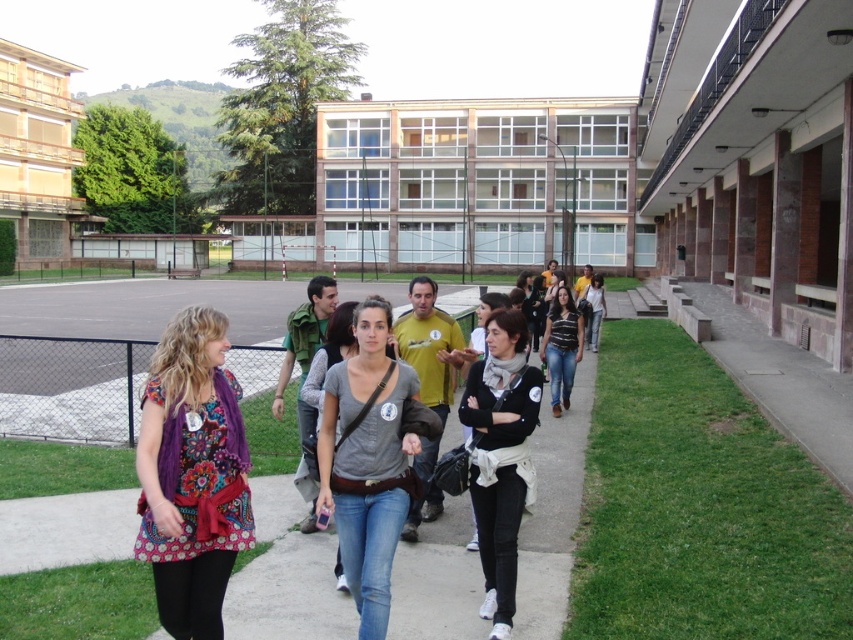
You are a delivery robot with a 3.5 feet wide package. You need to move from the green grass at lower right to the black matte jacket at center along the pathway. Is there enough space between them for your package?

The distance between the green grass at lower right and the black matte jacket at center is 5.09 feet. Since the package is 3.5 feet wide, there is sufficient space for the delivery robot to navigate through the pathway.